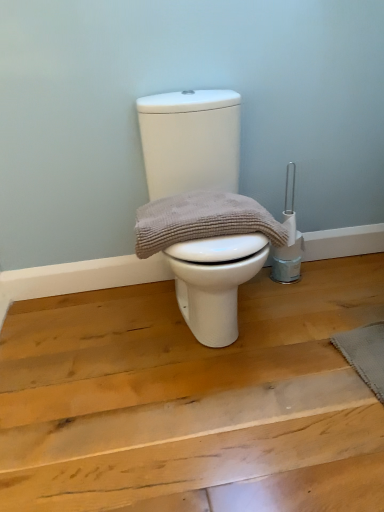
Question: Is beige textured towel at center shorter than gray textured mat at lower right?

Choices:
 (A) yes
 (B) no

Answer: (B)

Question: Is the depth of beige textured towel at center less than that of gray textured mat at lower right?

Choices:
 (A) no
 (B) yes

Answer: (B)

Question: Is beige textured towel at center with gray textured mat at lower right?

Choices:
 (A) no
 (B) yes

Answer: (A)

Question: From the image's perspective, is beige textured towel at center over gray textured mat at lower right?

Choices:
 (A) yes
 (B) no

Answer: (A)

Question: From a real-world perspective, is beige textured towel at center beneath gray textured mat at lower right?

Choices:
 (A) yes
 (B) no

Answer: (B)

Question: From the image's perspective, is gray textured mat at lower right positioned above or below beige textured towel at center?

Choices:
 (A) above
 (B) below

Answer: (B)

Question: Is point (369, 364) closer or farther from the camera than point (223, 210)?

Choices:
 (A) farther
 (B) closer

Answer: (A)

Question: Is gray textured mat at lower right spatially inside beige textured towel at center, or outside of it?

Choices:
 (A) inside
 (B) outside

Answer: (B)

Question: Relative to beige textured towel at center, is gray textured mat at lower right in front or behind?

Choices:
 (A) behind
 (B) front

Answer: (A)

Question: Is point (148, 229) positioned closer to the camera than point (367, 336)?

Choices:
 (A) farther
 (B) closer

Answer: (B)

Question: From a real-world perspective, is beige textured towel at center above or below gray textured mat at lower right?

Choices:
 (A) above
 (B) below

Answer: (A)

Question: Considering the relative positions of beige textured towel at center and gray textured mat at lower right in the image provided, is beige textured towel at center to the left or to the right of gray textured mat at lower right?

Choices:
 (A) left
 (B) right

Answer: (A)

Question: Is beige textured towel at center bigger or smaller than gray textured mat at lower right?

Choices:
 (A) big
 (B) small

Answer: (A)

Question: Is white matte toilet at center in front of or behind beige textured towel at center in the image?

Choices:
 (A) behind
 (B) front

Answer: (B)

Question: Is white matte toilet at center bigger or smaller than beige textured towel at center?

Choices:
 (A) big
 (B) small

Answer: (A)